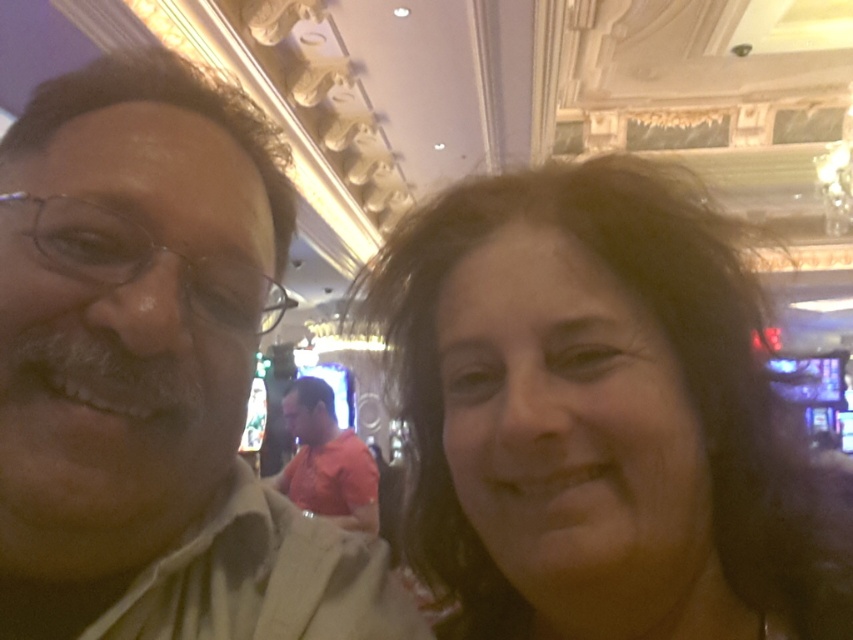
You are taking a photo of two people in a casino. You notice the dark brown hair at center and the matte beige shirt at left. Which object is located to the right of the other?

The dark brown hair at center is positioned on the right side of matte beige shirt at left.

You are taking a photo of two people in a casino. You notice the matte beige shirt at left and the orange cotton shirt at center. Which shirt is closer to the camera?

The matte beige shirt at left is closer to the camera because it is in front of the orange cotton shirt at center.

You are a photographer trying to position two models for a photo shoot. The models are wearing a matte beige shirt at left and an orange cotton shirt at center. Based on the scene described, which shirt is positioned to the right of the other?

The matte beige shirt at left is positioned to the right of the orange cotton shirt at center.